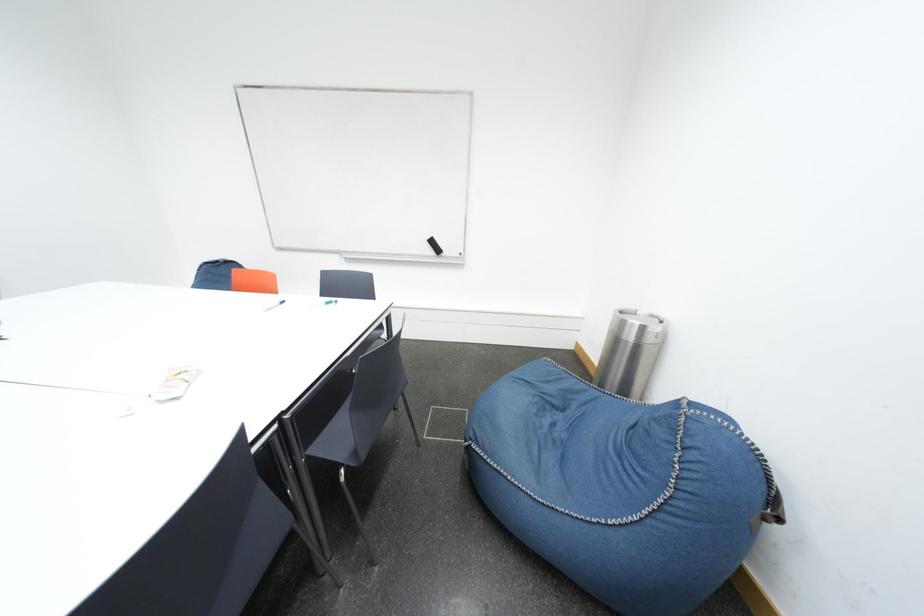
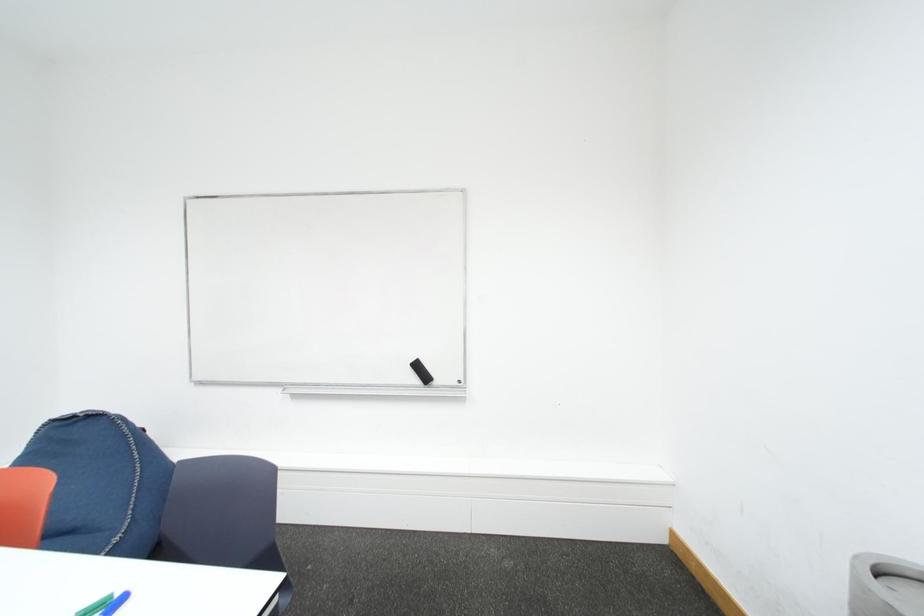
Question: The images are taken continuously from a first-person perspective. In which direction are you moving?

Choices:
 (A) Left
 (B) Right
 (C) Forward
 (D) Backward

Answer: (C)